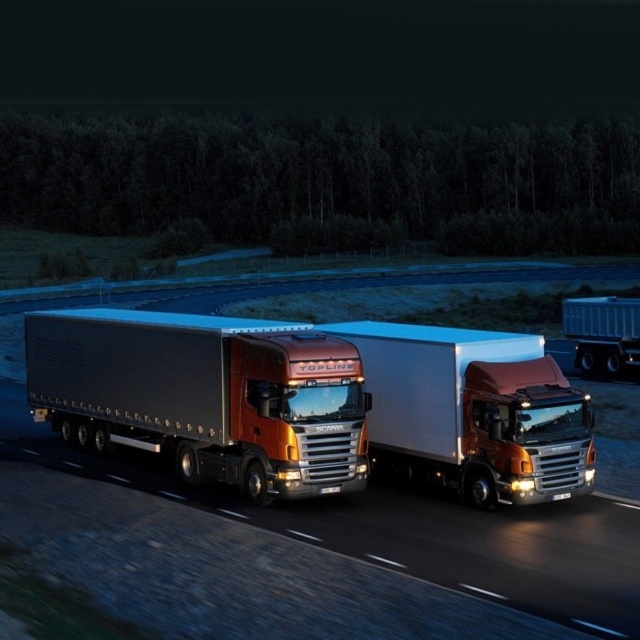
Does metallic silver trailer truck at center appear on the left side of metallic silver trailer at right?

Yes, metallic silver trailer truck at center is to the left of metallic silver trailer at right.

Which is in front, point (285, 392) or point (614, 333)?

Point (285, 392) is in front.

Image resolution: width=640 pixels, height=640 pixels. Describe the element at coordinates (205, 396) in the screenshot. I see `metallic silver trailer truck at center` at that location.

Image resolution: width=640 pixels, height=640 pixels. I want to click on metallic silver trailer truck at center, so click(205, 396).

Can you confirm if white glossy truck at center is positioned above metallic silver trailer at right?

Actually, white glossy truck at center is below metallic silver trailer at right.

Locate an element on the screen. This screenshot has width=640, height=640. white glossy truck at center is located at coordinates (474, 412).

Can you confirm if metallic silver trailer truck at center is bigger than white glossy truck at center?

Yes.

Can you confirm if metallic silver trailer truck at center is smaller than white glossy truck at center?

No.

You are a GUI agent. You are given a task and a screenshot of the screen. Output one action in this format:
    pyautogui.click(x=<x>, y=<y>)
    Task: Click on the metallic silver trailer truck at center
    This screenshot has height=640, width=640.
    Given the screenshot: What is the action you would take?
    pyautogui.click(x=205, y=396)

The image size is (640, 640). I want to click on metallic silver trailer truck at center, so click(205, 396).